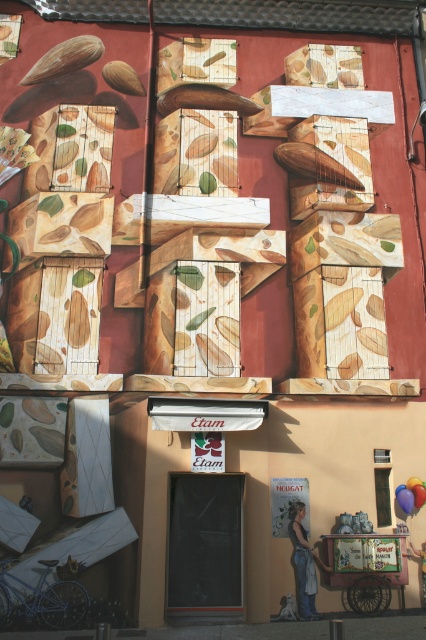
Can you confirm if matte brown mushroom at upper left is shorter than brown wood nut at upper left?

In fact, matte brown mushroom at upper left may be taller than brown wood nut at upper left.

This screenshot has height=640, width=426. Find the location of `matte brown mushroom at upper left`. matte brown mushroom at upper left is located at coordinates (65, 58).

Is point (25, 83) more distant than point (131, 84)?

That is False.

The image size is (426, 640). I want to click on matte brown mushroom at upper left, so click(x=65, y=58).